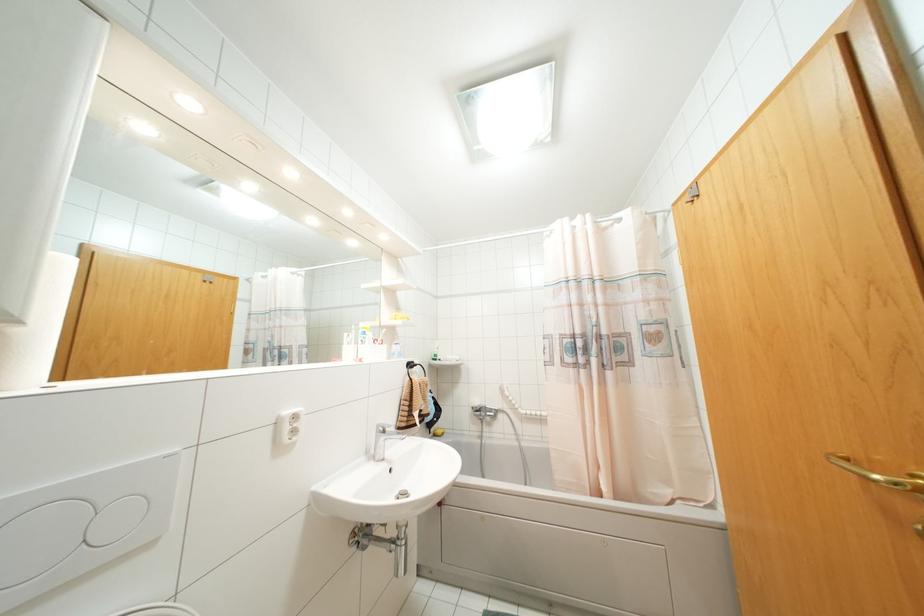
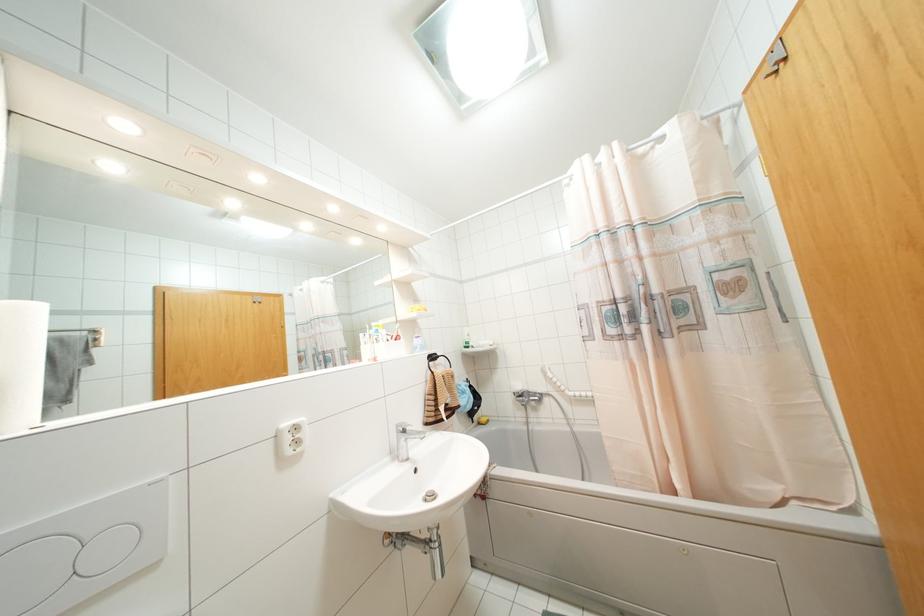
The point at (383,431) is marked in the first image. Where is the corresponding point in the second image?

(404, 431)